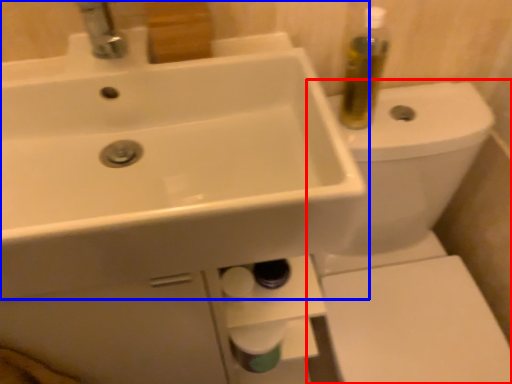
Question: Which point is further to the camera, toilet (highlighted by a red box) or sink (highlighted by a blue box)?

Choices:
 (A) toilet
 (B) sink

Answer: (A)